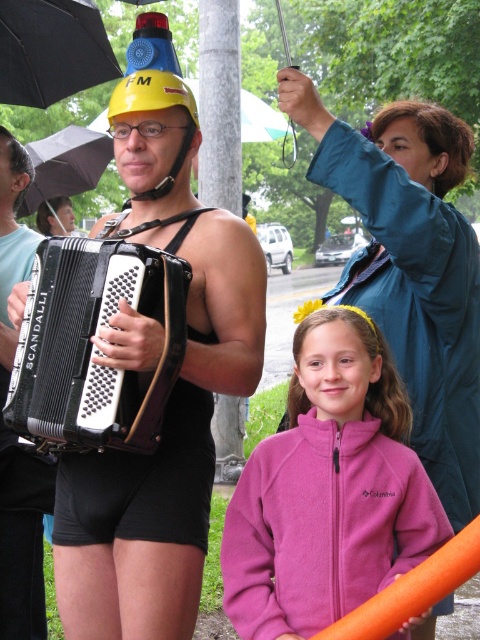
You are an event planner looking to place a small banner on the teal fabric jacket at upper right. The jacket is located at coordinates point (410, 268). If you want to place the banner 0.1 units to the left of the jacket, what would be the new coordinates?

The new coordinates would be 0.419 minus 0.1 equals 0.319, so the new point is 0.319, 0.856.

You are a photographer trying to capture a clear shot of both the teal fabric jacket at upper right and the matte black swimsuit at center. Since you want both subjects in focus, which one should you adjust your camera focus on first?

The teal fabric jacket at upper right is closer to the viewer than the matte black swimsuit at center, so you should focus on the teal fabric jacket at upper right first to ensure both are in focus.